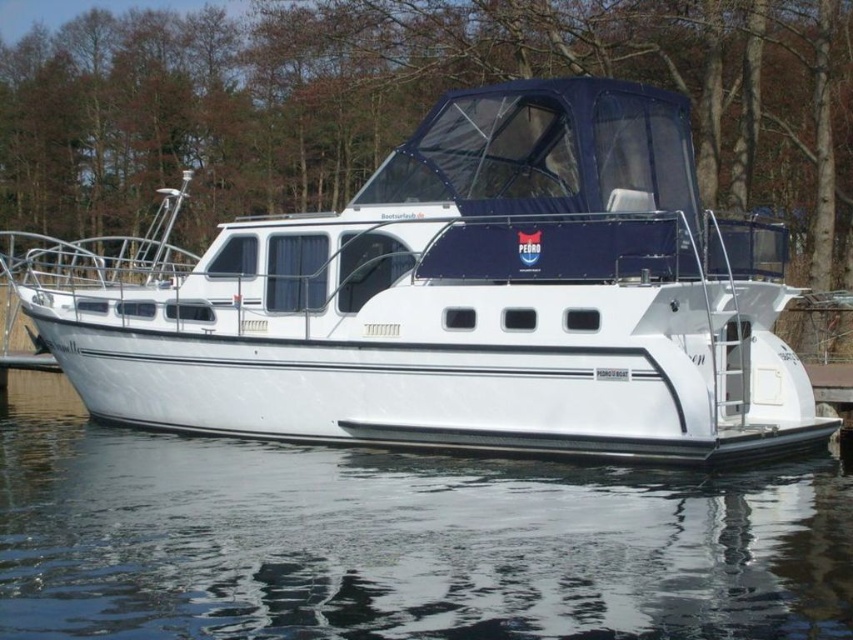
Which is behind, point (560, 77) or point (206, 502)?

The point (560, 77) is behind.

Between white glossy boat at center and transparent water at lower center, which one has less height?

transparent water at lower center is shorter.

Find the location of a particular element. Image resolution: width=853 pixels, height=640 pixels. white glossy boat at center is located at coordinates (457, 300).